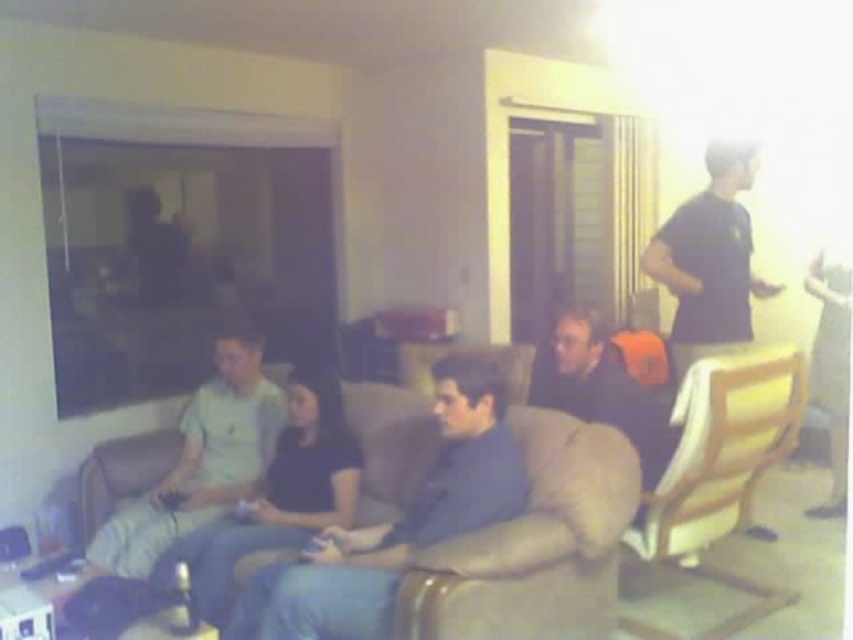
Question: Does blue fabric couch at center appear under black matte shirt at upper right?

Choices:
 (A) yes
 (B) no

Answer: (A)

Question: Which of these objects is positioned closest to the black matte shirt at upper right?

Choices:
 (A) blue fabric couch at center
 (B) wooden chair at right

Answer: (B)

Question: Among these objects, which one is farthest from the camera?

Choices:
 (A) light green fabric shirt at left
 (B) dark blue shirt at center
 (C) wooden chair at right

Answer: (B)

Question: Based on their relative distances, which object is nearer to the wooden chair at right?

Choices:
 (A) dark blue shirt at center
 (B) blue fabric couch at center
 (C) light green fabric shirt at left

Answer: (A)

Question: Is blue fabric couch at center bigger than light green fabric shirt at left?

Choices:
 (A) no
 (B) yes

Answer: (B)

Question: Can you confirm if wooden chair at right is positioned to the left of light green fabric shirt at left?

Choices:
 (A) yes
 (B) no

Answer: (B)